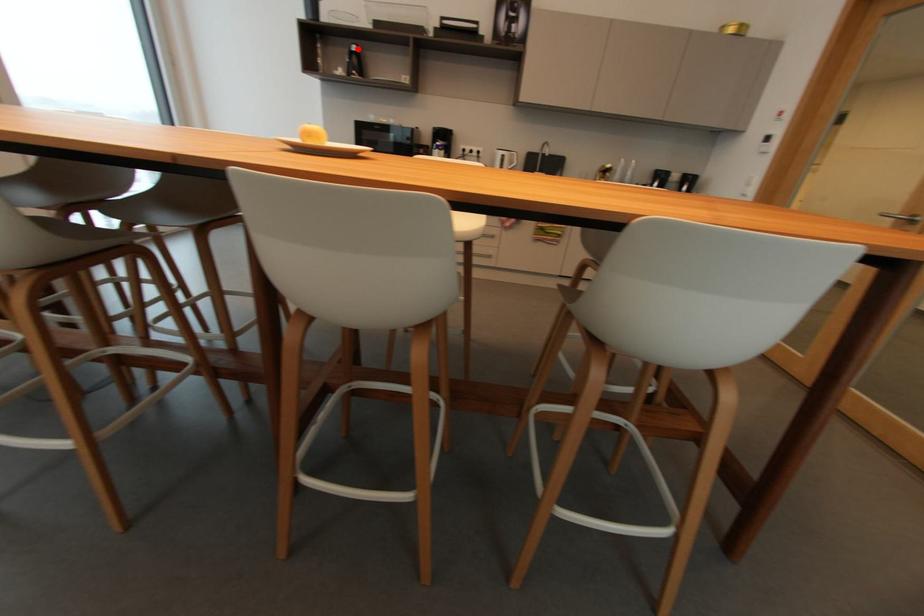
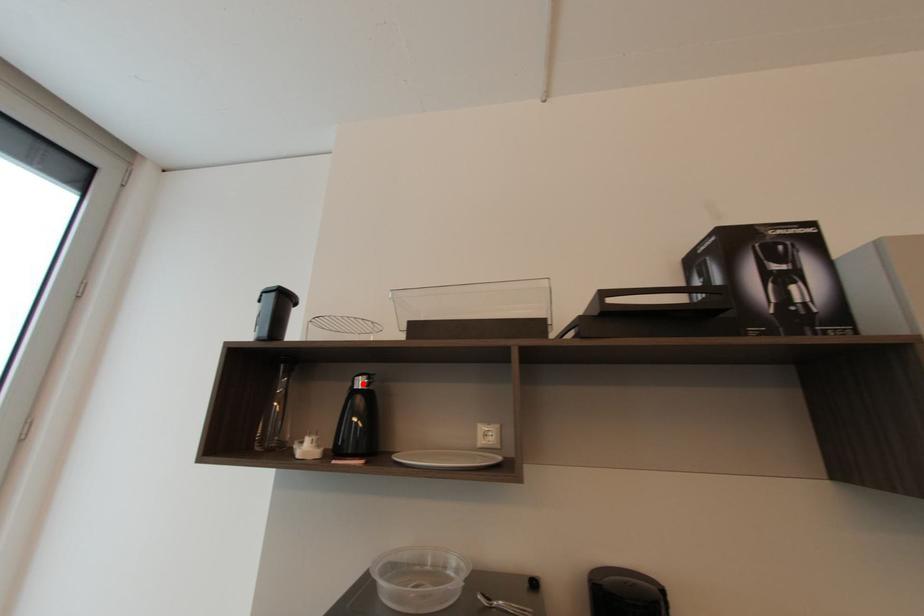
I am providing you with two images of the same scene from different viewpoints. A red point is marked on the first image and another point is marked on the second image. Is the red point in image1 aligned with the point shown in image2?

Yes